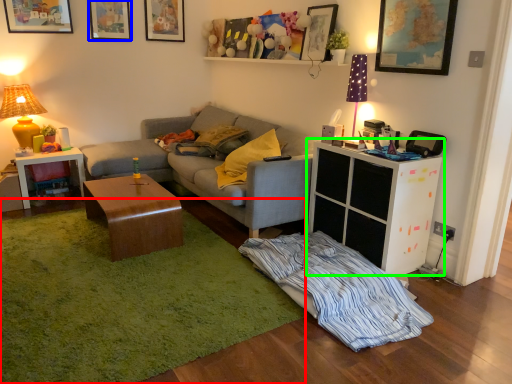
Question: Which object is positioned farthest from plain (highlighted by a red box)? Select from picture frame (highlighted by a blue box) and cabinetry (highlighted by a green box).

Choices:
 (A) picture frame
 (B) cabinetry

Answer: (A)